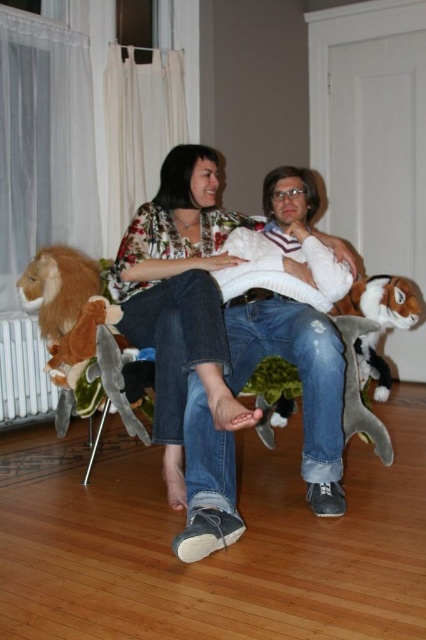
You are a photographer setting up a shoot in this scene. You need to place a small prop between the floral print blouse at center and the white metallic radiator at lower left. Based on their positions, which side of the radiator should the prop be placed on?

The floral print blouse at center is positioned on the right side of the white metallic radiator at lower left, so the prop should be placed to the right of the radiator to place it between them.

Based on the scene description, which object is taller between the floral print blouse at center and the white metallic radiator at lower left?

The floral print blouse at center is taller than the white metallic radiator at lower left.

You are designing a new room layout and want to place the floral print blouse at center and the white metallic radiator at lower left. Given their sizes, which object should be placed closer to the entrance to ensure visibility?

The floral print blouse at center is bigger than the white metallic radiator at lower left, so placing it closer to the entrance will ensure better visibility due to its larger size.